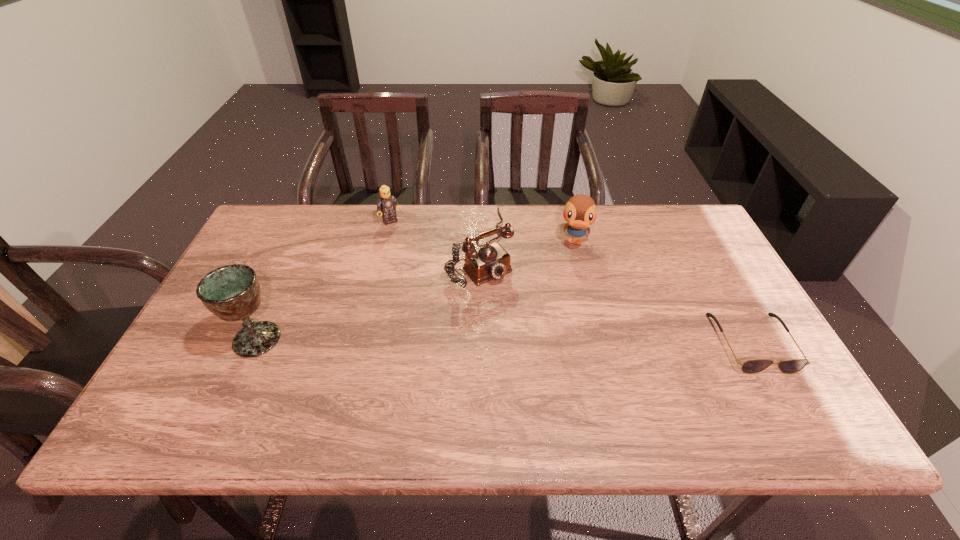
Locate an element on the screen. Image resolution: width=960 pixels, height=540 pixels. the leftmost object is located at coordinates (232, 292).

Where is `chalice`? This screenshot has width=960, height=540. chalice is located at coordinates (232, 292).

Image resolution: width=960 pixels, height=540 pixels. Identify the location of the rightmost object. (753, 366).

Locate an element on the screen. The width and height of the screenshot is (960, 540). the shortest object is located at coordinates (753, 366).

I want to click on Lego, so click(386, 203).

Image resolution: width=960 pixels, height=540 pixels. I want to click on duck, so click(x=580, y=211).

You are a GUI agent. You are given a task and a screenshot of the screen. Output one action in this format:
    pyautogui.click(x=<x>, y=<y>)
    Task: Click on the third object from right to left
    
    Given the screenshot: What is the action you would take?
    pyautogui.click(x=491, y=261)

Identify the location of vacant area situated 0.080m on the back of the chalice. Image resolution: width=960 pixels, height=540 pixels. (276, 298).

Identify the location of free space located 0.190m in front of the Lego. Image resolution: width=960 pixels, height=540 pixels. (420, 260).

Identify the location of free space located in front of the Lego. This screenshot has height=540, width=960. (441, 289).